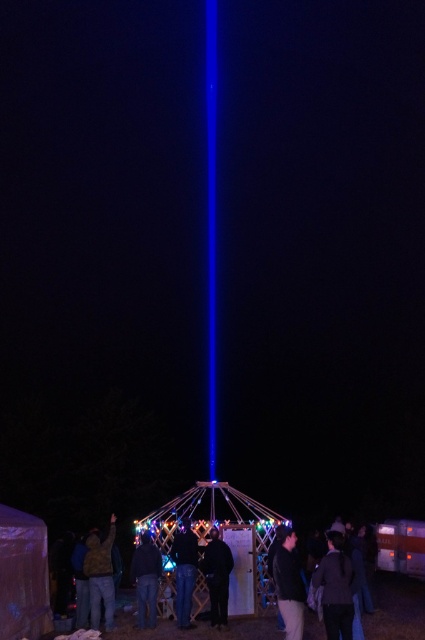
Question: Is dark gray fabric at lower right to the right of jeans at center from the viewer's perspective?

Choices:
 (A) no
 (B) yes

Answer: (B)

Question: Is dark blue leather jacket at lower right above brown leather jacket at lower left?

Choices:
 (A) no
 (B) yes

Answer: (B)

Question: Can you confirm if brown leather jacket at lower left is positioned to the right of dark blue jeans at center?

Choices:
 (A) no
 (B) yes

Answer: (A)

Question: Which point is farther to the camera?

Choices:
 (A) jeans at center
 (B) dark blue leather jacket at lower right

Answer: (A)

Question: Which is farther from the dark blue leather jacket at lower right?

Choices:
 (A) black matte jacket at lower center
 (B) jeans at center
 (C) dark gray fabric at lower right
 (D) brown leather jacket at lower left

Answer: (D)

Question: Estimate the real-world distances between objects in this image. Which object is closer to the black matte jacket at lower center?

Choices:
 (A) dark gray fabric at lower right
 (B) dark blue leather jacket at lower right
 (C) jeans at center
 (D) dark blue jeans at center

Answer: (C)